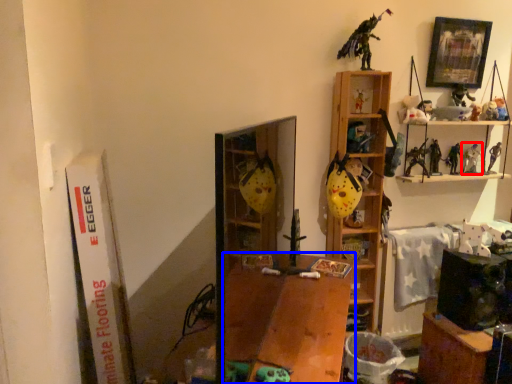
Question: Among these objects, which one is farthest to the camera, toy (highlighted by a red box) or table (highlighted by a blue box)?

Choices:
 (A) toy
 (B) table

Answer: (A)